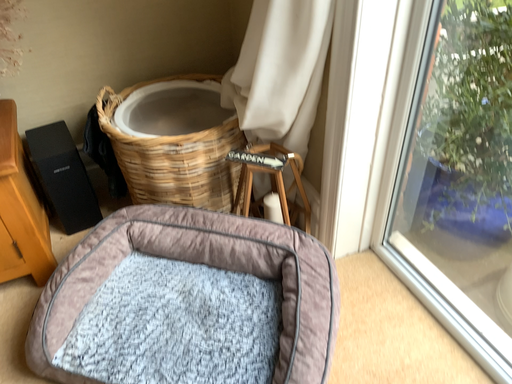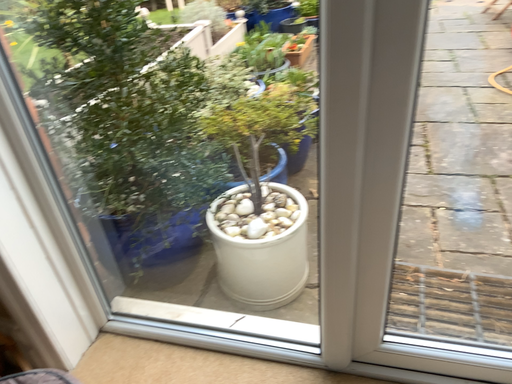
Question: Which way did the camera rotate in the video?

Choices:
 (A) rotated upward
 (B) rotated downward

Answer: (A)